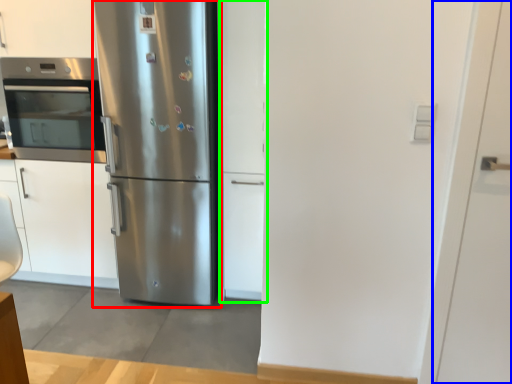
Question: Which object is positioned farthest from refrigerator (highlighted by a red box)? Select from door (highlighted by a blue box) and door (highlighted by a green box).

Choices:
 (A) door
 (B) door

Answer: (A)